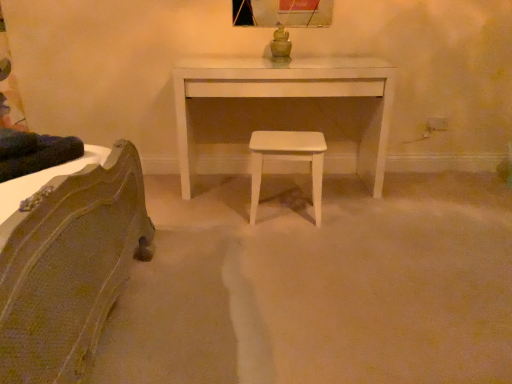
Locate an element on the screen. white wood stool at center is located at coordinates click(x=287, y=159).

This screenshot has height=384, width=512. Describe the element at coordinates (287, 159) in the screenshot. I see `white wood stool at center` at that location.

The image size is (512, 384). What are the coordinates of `white matte table at center` in the screenshot? It's located at (290, 97).

The height and width of the screenshot is (384, 512). What do you see at coordinates (290, 97) in the screenshot? I see `white matte table at center` at bounding box center [290, 97].

The image size is (512, 384). I want to click on white wood stool at center, so coord(287,159).

Which is more to the left, white matte table at center or white wood stool at center?

Positioned to the left is white matte table at center.

Is white matte table at center positioned in front of white wood stool at center?

No, the depth of white matte table at center is greater than that of white wood stool at center.

Is point (378, 108) in front of point (319, 152)?

No.

From the image's perspective, which one is positioned lower, white matte table at center or white wood stool at center?

white wood stool at center is shown below in the image.

From a real-world perspective, is white matte table at center positioned above or below white wood stool at center?

From a real-world perspective, white matte table at center is physically above white wood stool at center.

Looking at their sizes, would you say white matte table at center is wider or thinner than white wood stool at center?

white matte table at center is wider than white wood stool at center.

Considering the sizes of objects white matte table at center and white wood stool at center in the image provided, who is shorter, white matte table at center or white wood stool at center?

white wood stool at center.

Considering the sizes of objects white matte table at center and white wood stool at center in the image provided, who is bigger, white matte table at center or white wood stool at center?

white matte table at center.

Which is correct: white matte table at center is inside white wood stool at center, or outside of it?

white matte table at center cannot be found inside white wood stool at center.

Can you see white matte table at center touching white wood stool at center?

No, white matte table at center is not with white wood stool at center.

Is white matte table at center looking in the opposite direction of white wood stool at center?

Yes.

What's the angular difference between white matte table at center and white wood stool at center's facing directions?

0.178 degrees.

You are a GUI agent. You are given a task and a screenshot of the screen. Output one action in this format:
    pyautogui.click(x=<x>, y=<y>)
    Task: Click on the stool on the right of white matte table at center
    Image resolution: width=512 pixels, height=384 pixels.
    Given the screenshot: What is the action you would take?
    pyautogui.click(x=287, y=159)

Between white wood stool at center and white matte table at center, which one appears on the left side from the viewer's perspective?

white matte table at center is more to the left.

Is the position of white wood stool at center less distant than that of white matte table at center?

Yes.

Which is in front, point (253, 166) or point (387, 78)?

Positioned in front is point (253, 166).

From the image's perspective, does white wood stool at center appear lower than white matte table at center?

Yes, from the image's perspective, white wood stool at center is beneath white matte table at center.

Based on the photo, from a real-world perspective, is white wood stool at center positioned above or below white matte table at center?

Clearly, from a real-world perspective, white wood stool at center is below white matte table at center.

Considering the sizes of objects white wood stool at center and white matte table at center in the image provided, who is wider, white wood stool at center or white matte table at center?

white matte table at center.

Based on the photo, which of these two, white wood stool at center or white matte table at center, stands shorter?

white wood stool at center is shorter.

Is white wood stool at center smaller than white matte table at center?

Yes.

Is white wood stool at center inside or outside of white matte table at center?

The correct answer is: outside.

Would you say white wood stool at center is a long distance from white matte table at center?

No, white wood stool at center is not far away from white matte table at center.

Is white wood stool at center positioned with its back to white matte table at center?

Yes, white matte table at center is at the back of white wood stool at center.

Can you tell me how much white wood stool at center and white matte table at center differ in facing direction?

The angular difference between white wood stool at center and white matte table at center is 0.178 degrees.

The height and width of the screenshot is (384, 512). In the image, there is a white matte table at center. Find the location of `stool below it (from a real-world perspective)`. stool below it (from a real-world perspective) is located at coordinates (287, 159).

Find the location of a particular element. This screenshot has width=512, height=384. stool that appears below the white matte table at center (from a real-world perspective) is located at coordinates (287, 159).

Identify the location of stool located below the white matte table at center (from the image's perspective). (287, 159).